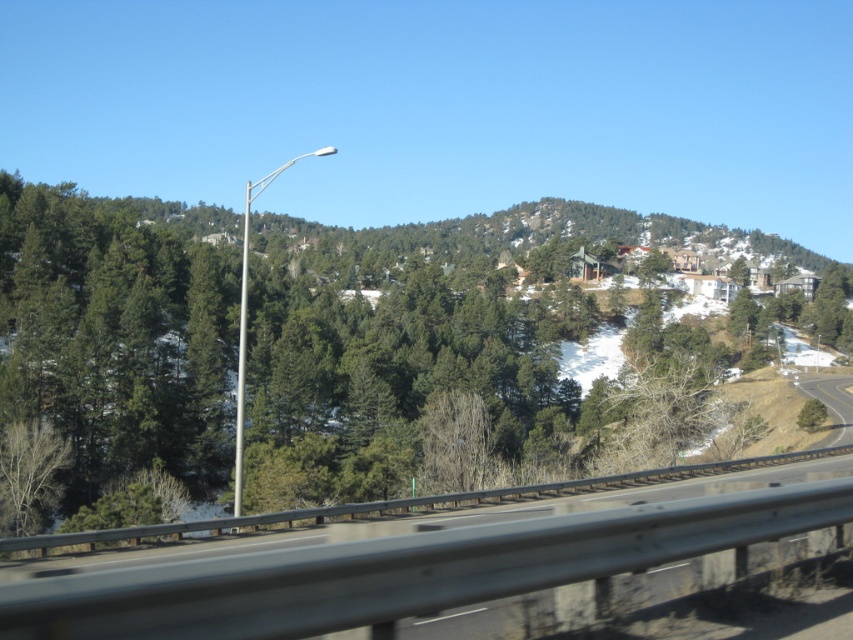
You are a photographer trying to capture a specific tree in the center of your image. The camera you are using has a focal point that can be adjusted to coordinates. What are the coordinates of the green evergreen tree at center that you need to focus on?

The green evergreen tree at center is located at coordinates point (451, 381).

You are navigating a vehicle and want to stay on the metallic gray highway at center. Based on the scene, where should you position your vehicle relative to the tall streetlamp on the left side?

The metallic gray highway at center is located at point (404, 570), so you should position your vehicle towards the center of the highway, keeping the tall streetlamp on the left side as a reference point to stay on course.

You are a passenger in a car traveling along the highway. You notice two points marked on the road ahead. The first point is at coordinates point (444, 547) and the second is at point (241, 312). Based on the scene, which point will the car reach first?

The car will reach point (444, 547) first because it is in front of point (241, 312) in the scene.